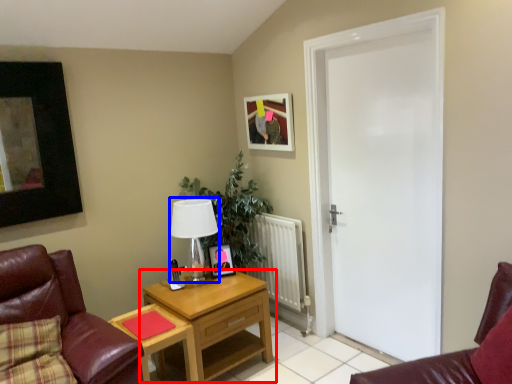
Question: Which point is closer to the camera, nightstand (highlighted by a red box) or table lamp (highlighted by a blue box)?

Choices:
 (A) nightstand
 (B) table lamp

Answer: (A)